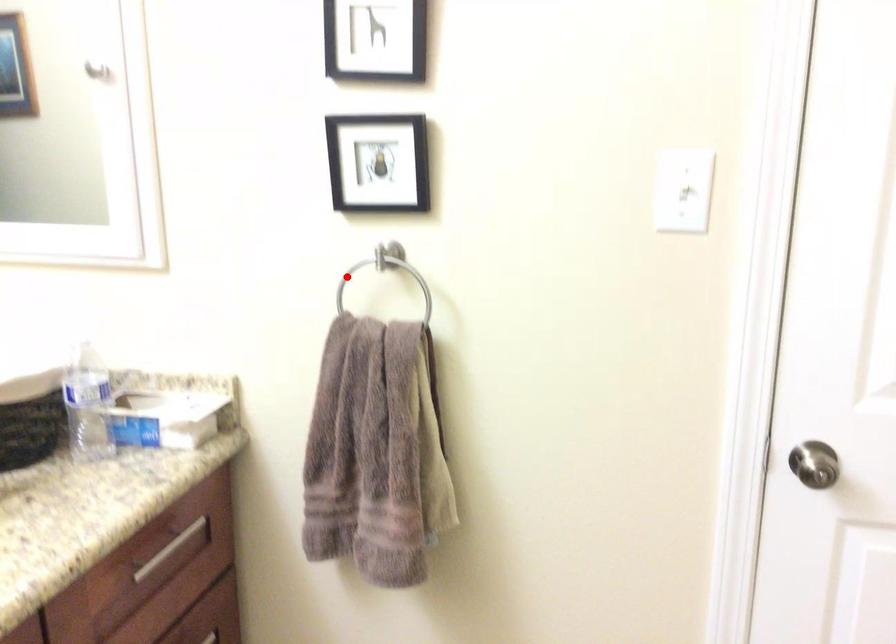
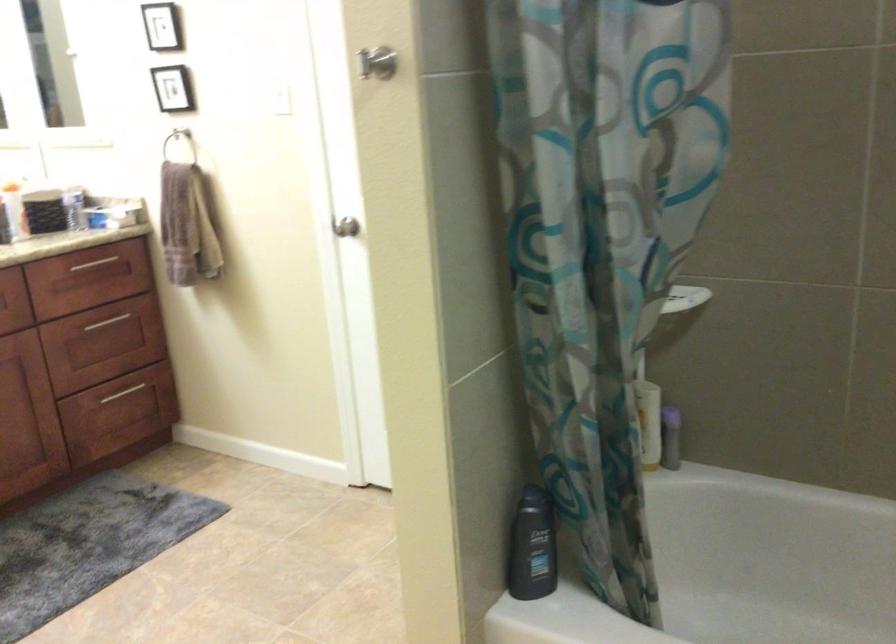
Where in the second image is the point corresponding to the highlighted location from the first image?

(177, 138)